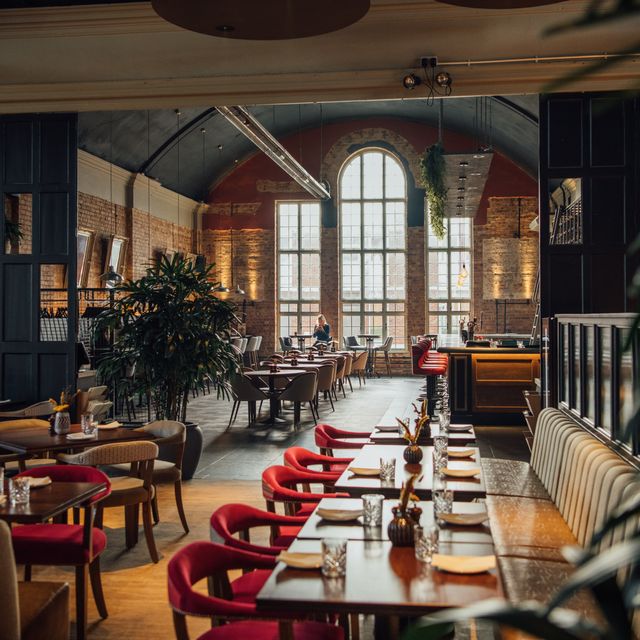
This screenshot has height=640, width=640. Find the location of `hanging plant`. hanging plant is located at coordinates (433, 162).